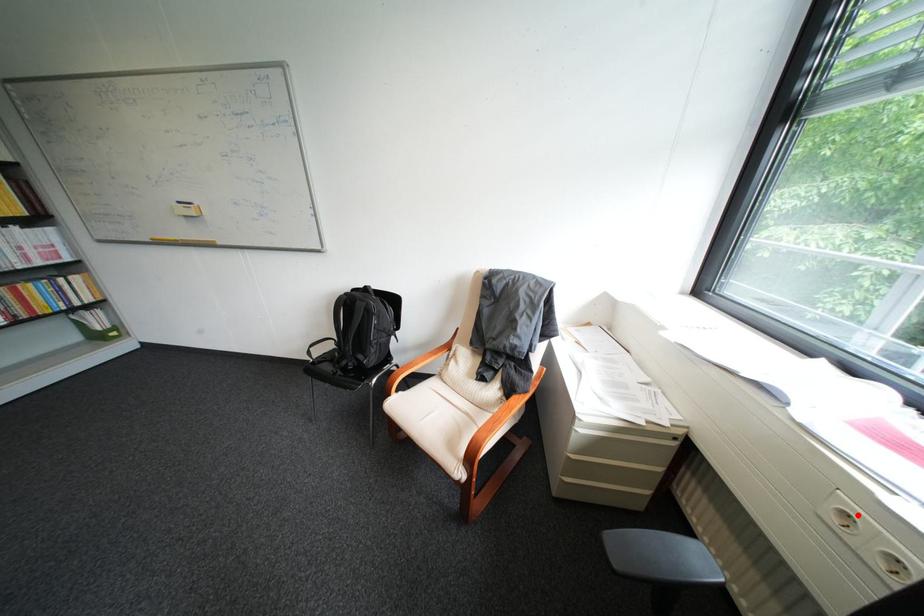
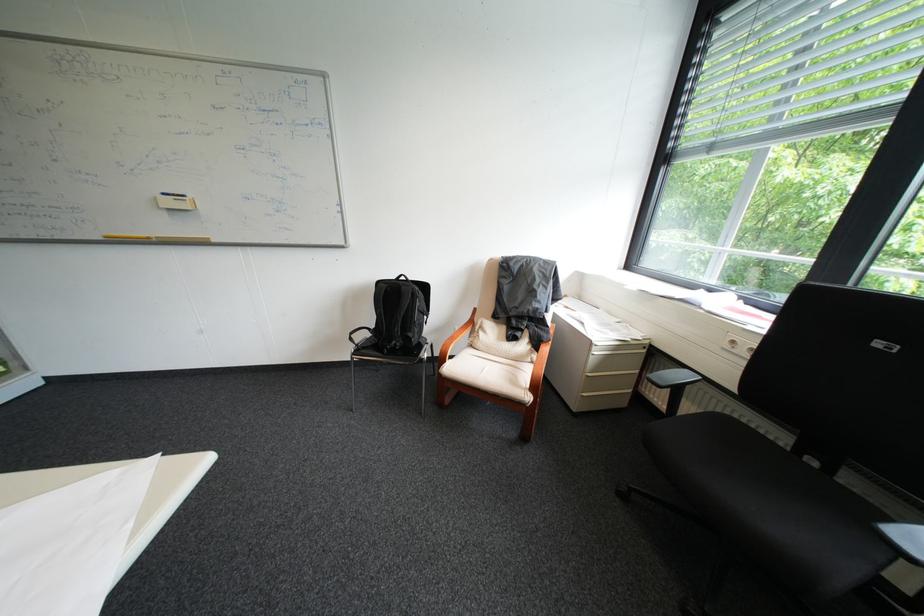
Question: I am providing you with two images of the same scene from different viewpoints. Given a red point in image1, look at the same physical point in image2. Is it:

Choices:
 (A) Closer to the viewpoint
 (B) Farther from the viewpoint

Answer: (A)